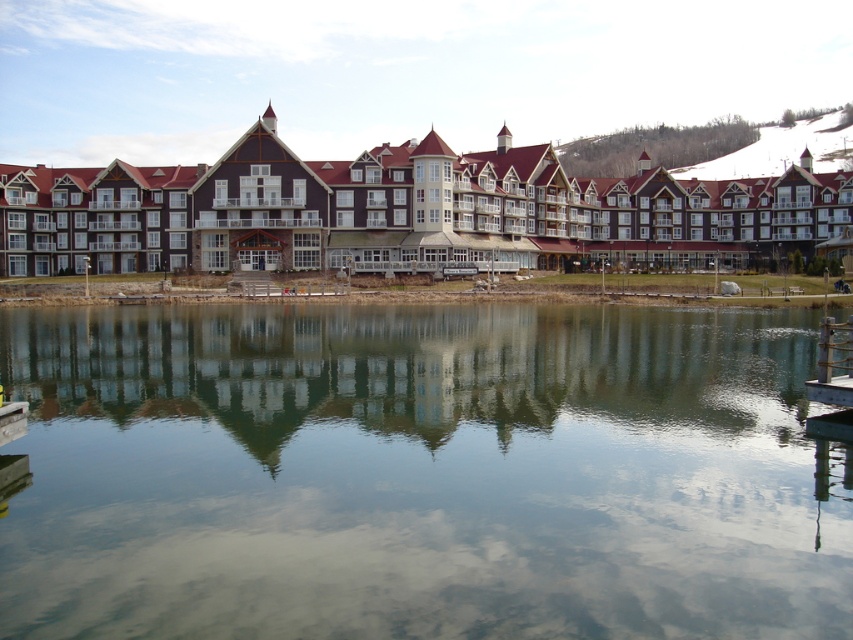
Which is more to the right, clear glass water at center or wooden dock at lower right?

From the viewer's perspective, wooden dock at lower right appears more on the right side.

Between point (437, 509) and point (816, 365), which one is positioned behind?

The point (816, 365) is behind.

Locate an element on the screen. clear glass water at center is located at coordinates (421, 474).

Between brown wooden resort at center and wooden dock at lower right, which one has more height?

brown wooden resort at center

Who is more distant from viewer, (268, 122) or (834, 371)?

The point (268, 122) is more distant.

Image resolution: width=853 pixels, height=640 pixels. Identify the location of brown wooden resort at center. (405, 212).

Does clear glass water at center have a lesser height compared to brown wooden resort at center?

Indeed, clear glass water at center has a lesser height compared to brown wooden resort at center.

Does clear glass water at center have a smaller size compared to brown wooden resort at center?

Yes.

You are a GUI agent. You are given a task and a screenshot of the screen. Output one action in this format:
    pyautogui.click(x=<x>, y=<y>)
    Task: Click on the clear glass water at center
    The height and width of the screenshot is (640, 853).
    Given the screenshot: What is the action you would take?
    pyautogui.click(x=421, y=474)

Identify the location of clear glass water at center. (421, 474).